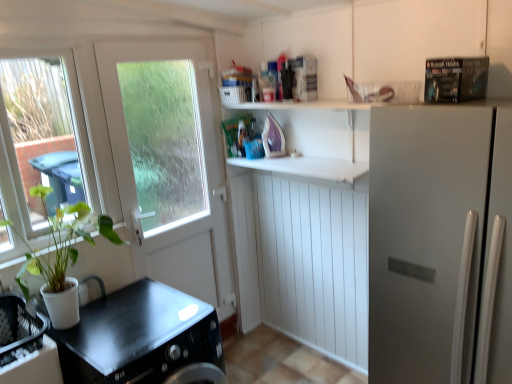
Question: From a real-world perspective, is white matte counter top at center, arranged as the second counter top when ordered from the bottom, physically located above or below black matte countertop at lower left, acting as the first counter top starting from the bottom?

Choices:
 (A) below
 (B) above

Answer: (B)

Question: Is point (253, 165) closer or farther from the camera than point (111, 349)?

Choices:
 (A) closer
 (B) farther

Answer: (B)

Question: Estimate the real-world distances between objects in this image. Which object is closer to the white matte counter top at center, acting as the first counter top starting from the top?

Choices:
 (A) black matte countertop at lower left, acting as the first counter top starting from the bottom
 (B) white matte refrigerator at right
 (C) green matte plant at left
 (D) clear glass window at left
 (E) white matte door at upper left

Answer: (E)

Question: Estimate the real-world distances between objects in this image. Which object is farther from the metallic silver magazine at upper right?

Choices:
 (A) white matte refrigerator at right
 (B) white matte counter top at center, acting as the first counter top starting from the top
 (C) white matte door at upper left
 (D) green matte plant at left
 (E) black matte countertop at lower left, the 2th counter top in the top-to-bottom sequence

Answer: (D)